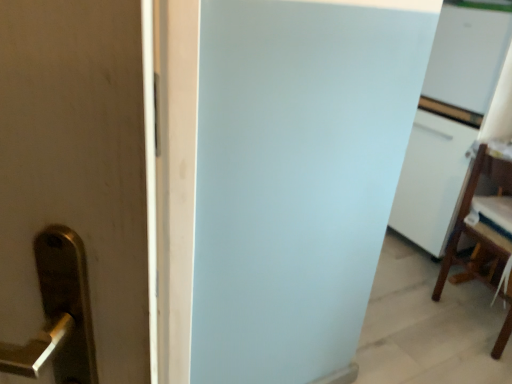
At what (x,y) coordinates should I click in order to perform the action: click on brown wooden chair at lower right. Please return your answer as a coordinate pair (x, y). The image size is (512, 384). Looking at the image, I should click on (486, 236).

Measure the distance between brown wooden chair at lower right and camera.

brown wooden chair at lower right is 1.71 meters from camera.

This screenshot has height=384, width=512. Describe the element at coordinates (486, 236) in the screenshot. I see `brown wooden chair at lower right` at that location.

The image size is (512, 384). Find the location of `brown wooden chair at lower right`. brown wooden chair at lower right is located at coordinates (486, 236).